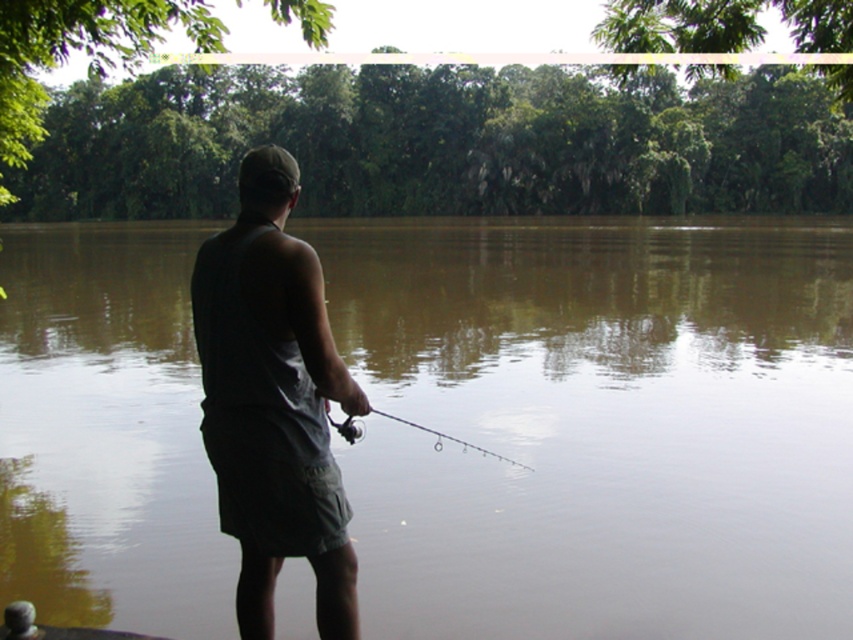
Between brown murky water at center and dark gray fabric tank top at center, which one is positioned lower?

Positioned lower is dark gray fabric tank top at center.

Is point (537, 353) less distant than point (270, 435)?

No, (537, 353) is behind (270, 435).

Identify the location of brown murky water at center. The width and height of the screenshot is (853, 640). (599, 422).

Can you confirm if dark gray fabric tank top at center is thinner than clear plastic rod at center?

No, dark gray fabric tank top at center is not thinner than clear plastic rod at center.

Image resolution: width=853 pixels, height=640 pixels. Describe the element at coordinates (273, 401) in the screenshot. I see `dark gray fabric tank top at center` at that location.

Image resolution: width=853 pixels, height=640 pixels. In order to click on dark gray fabric tank top at center in this screenshot , I will do `click(273, 401)`.

Does brown murky water at center have a smaller size compared to clear plastic rod at center?

Actually, brown murky water at center might be larger than clear plastic rod at center.

Does brown murky water at center have a lesser height compared to clear plastic rod at center?

In fact, brown murky water at center may be taller than clear plastic rod at center.

Is point (22, 484) in front of point (376, 410)?

No, it is behind (376, 410).

The height and width of the screenshot is (640, 853). In order to click on brown murky water at center in this screenshot , I will do (x=599, y=422).